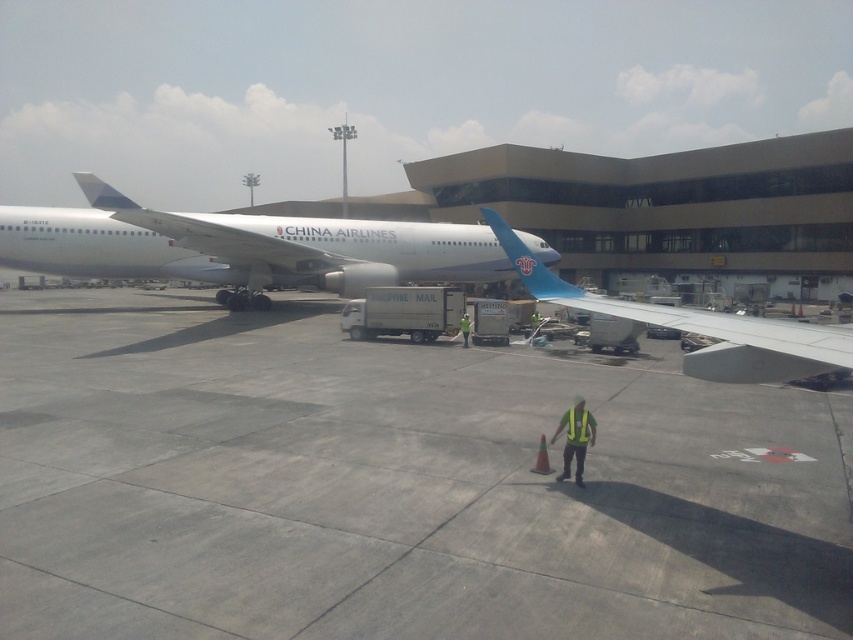
You are a pilot standing at the cockpit of the China Airlines aircraft. You need to check if there is enough space between the gray concrete tarmac at center and the yellow reflective safety vest at center to safely move the aircraft forward. Can you determine if there is enough space based on their positions?

The gray concrete tarmac at center is closer to the viewer than the yellow reflective safety vest at center, meaning the safety vest is further away. Therefore, there is sufficient space between them for the aircraft to move forward safely.

You are a pilot standing at the cockpit of the white glossy airplane at center. You need to check if there is any obstruction between your current position and the green reflective vest at center before opening the cockpit door. Based on the scene, is there any obstruction?

The white glossy airplane at center is in front of the green reflective vest at center, so there is an obstruction between the cockpit and the green reflective vest at center.

You are a pilot standing at the cockpit of the white glossy airplane at center. You need to check if there is any obstruction between you and the yellow reflective safety vest at center before opening the door. Based on the scene, can you safely open the door without hitting anything?

The white glossy airplane at center is further to the viewer than the yellow reflective safety vest at center, meaning the safety vest is closer to the airplane. Therefore, opening the door might hit the safety vest, so it is not safe to open the door without checking first.